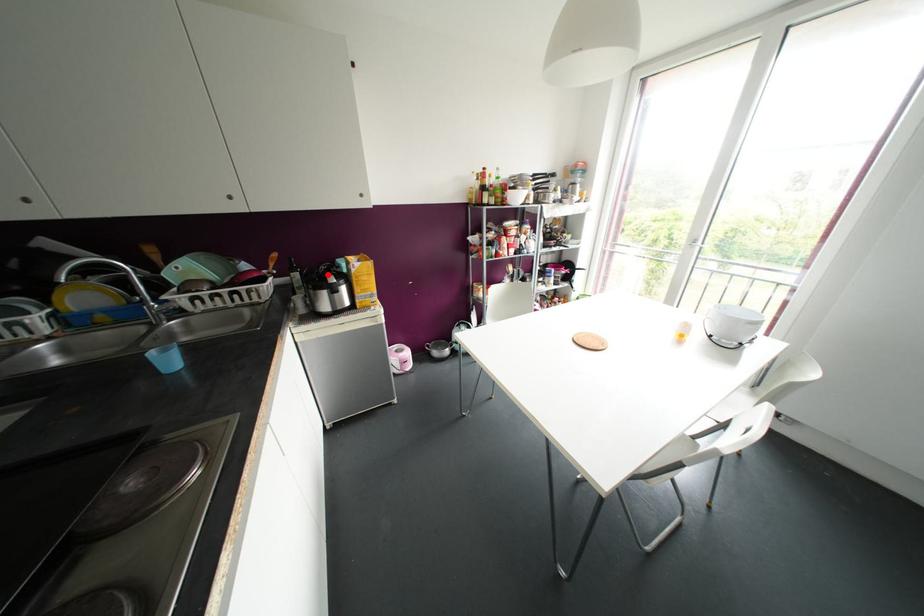
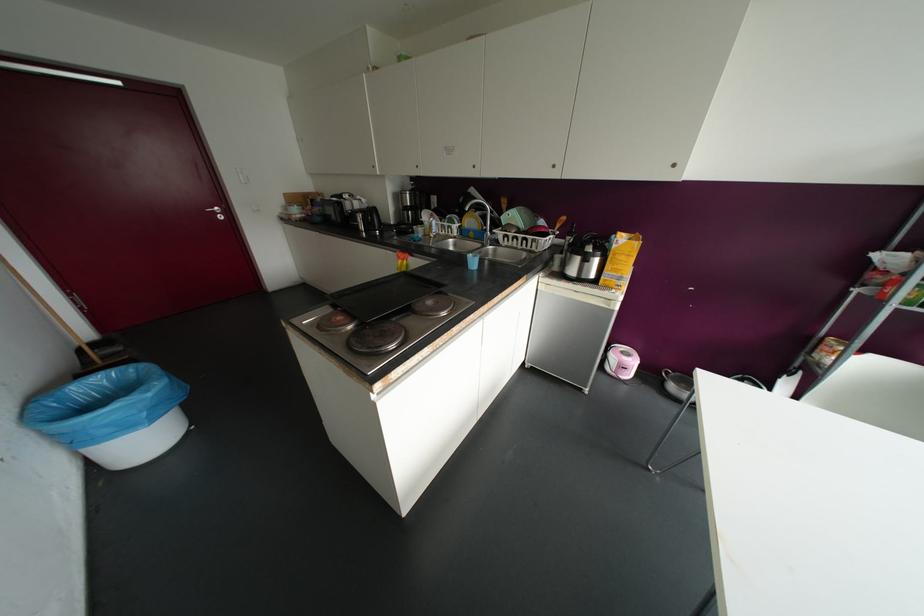
The point at the highlighted location is marked in the first image. Where is the corresponding point in the second image?

(589, 244)